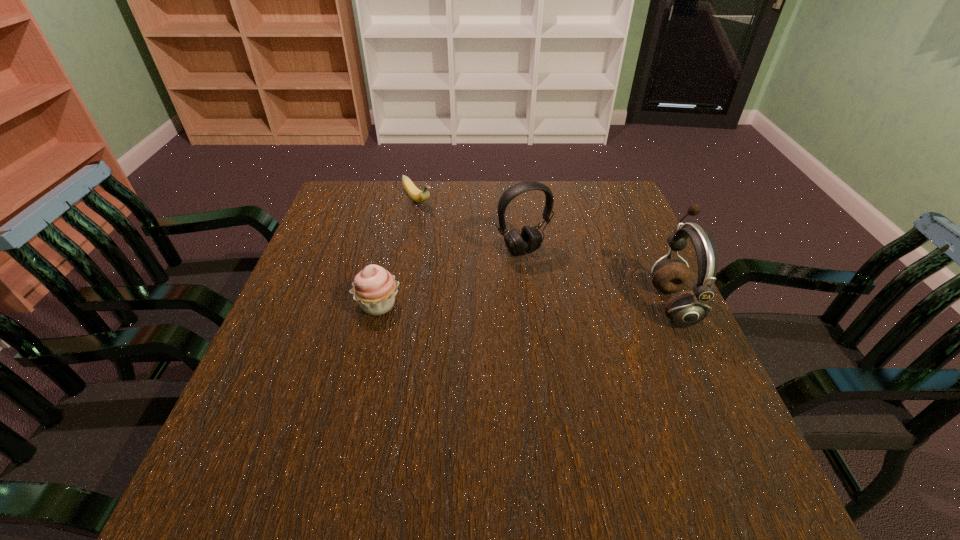
Find the location of a particular element. vacant space positioned on the front-facing side of the third nearest object is located at coordinates (565, 303).

Where is `free spot located on the front-facing side of the third nearest object`? This screenshot has width=960, height=540. free spot located on the front-facing side of the third nearest object is located at coordinates (x=616, y=374).

Locate an element on the screen. free region located on the front-facing side of the third nearest object is located at coordinates (547, 279).

Where is `free space located 0.240m at the stem of the shortest object`? free space located 0.240m at the stem of the shortest object is located at coordinates (468, 254).

Identify the location of vacant space located at the stem of the shortest object. (463, 248).

Find the location of a particular element. This screenshot has height=540, width=960. free region located at the stem of the shortest object is located at coordinates (454, 241).

What are the coordinates of `object present at the far edge` in the screenshot? It's located at 414,193.

Identify the location of object that is positioned at the left edge. (374, 288).

Locate an element on the screen. This screenshot has height=540, width=960. object that is positioned at the right edge is located at coordinates (687, 308).

Find the location of a particular element. This screenshot has height=540, width=960. vacant region at the far edge of the desktop is located at coordinates (447, 181).